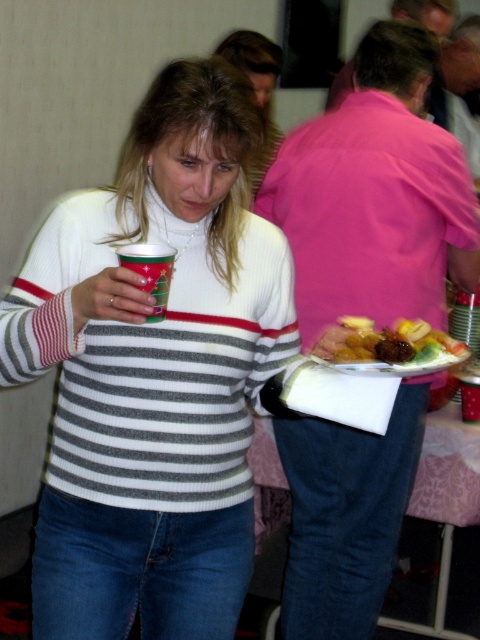
Question: From the image, what is the correct spatial relationship of glossy plastic plate at lower center in relation to christmas tree paper cup at left?

Choices:
 (A) left
 (B) right

Answer: (B)

Question: Estimate the real-world distances between objects in this image. Which object is farther from the white knit sweater at center?

Choices:
 (A) glossy plastic plate at lower center
 (B) christmas tree paper cup at left

Answer: (A)

Question: Which point is farther from the camera taking this photo?

Choices:
 (A) (156, 264)
 (B) (231, 440)
 (C) (396, 328)
 (D) (420, 492)

Answer: (D)

Question: Among these points, which one is nearest to the camera?

Choices:
 (A) (277, 467)
 (B) (134, 250)
 (C) (144, 600)
 (D) (431, 353)

Answer: (B)

Question: Is white knit sweater at center wider than glossy plastic plate at lower center?

Choices:
 (A) no
 (B) yes

Answer: (B)

Question: Can you confirm if white knit sweater at center is thinner than glossy plastic plate at lower center?

Choices:
 (A) yes
 (B) no

Answer: (B)